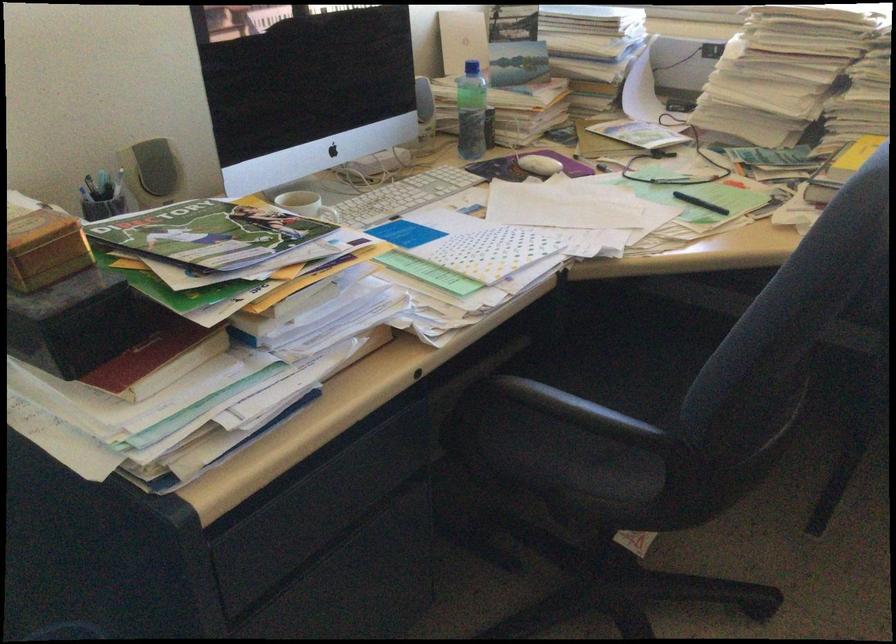
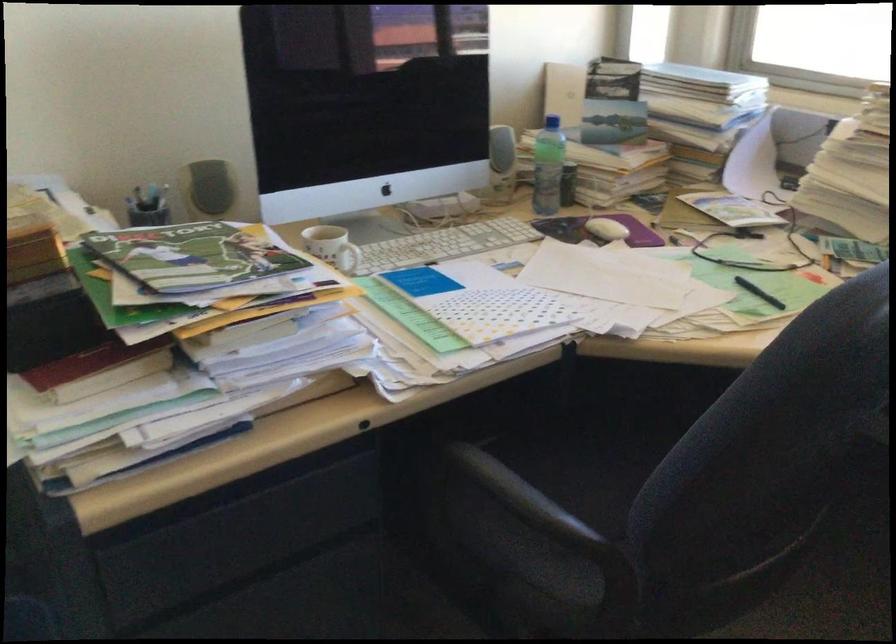
Find the pixel in the second image that matches (702,200) in the first image.

(759, 292)